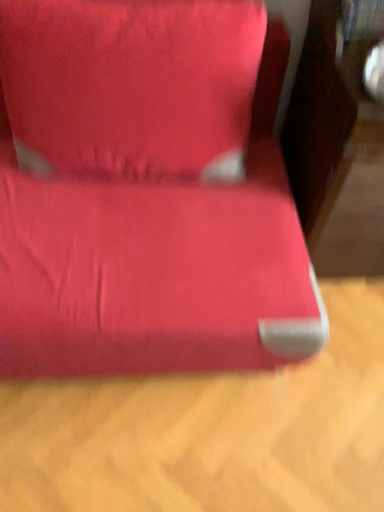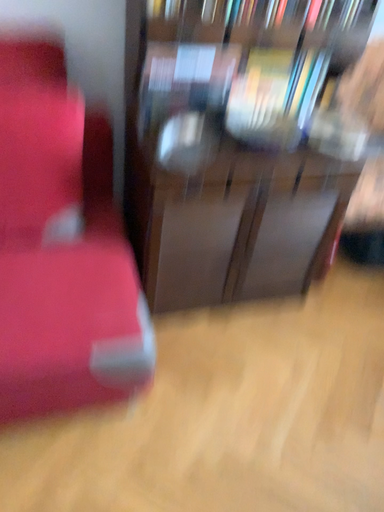
Question: How did the camera likely rotate when shooting the video?

Choices:
 (A) rotated upward
 (B) rotated downward

Answer: (A)